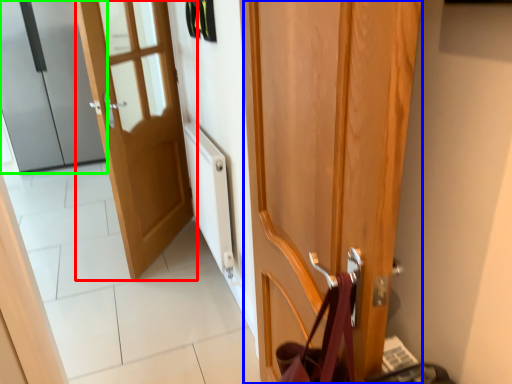
Question: Which object is the farthest from door (highlighted by a red box)? Choose among these: door (highlighted by a blue box) or door (highlighted by a green box).

Choices:
 (A) door
 (B) door

Answer: (B)